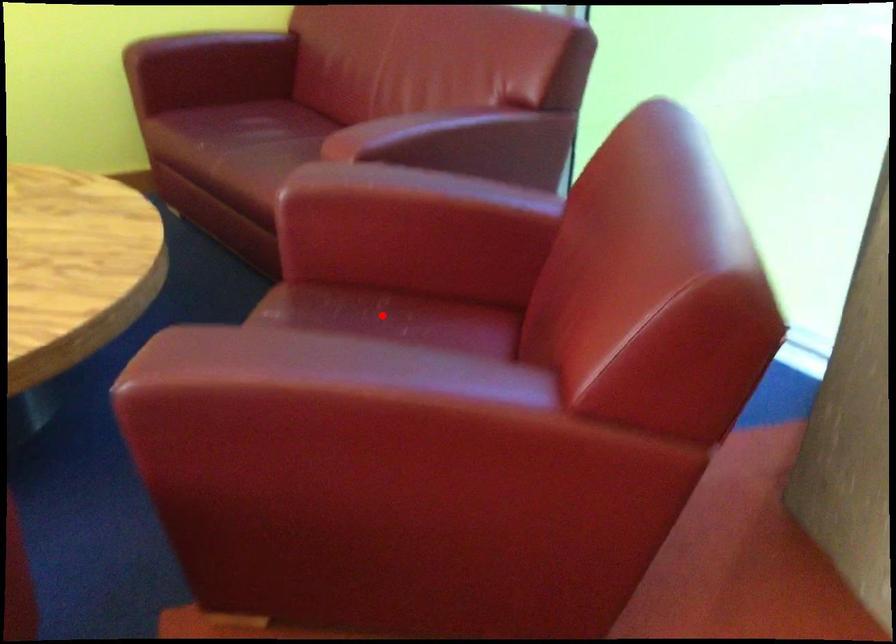
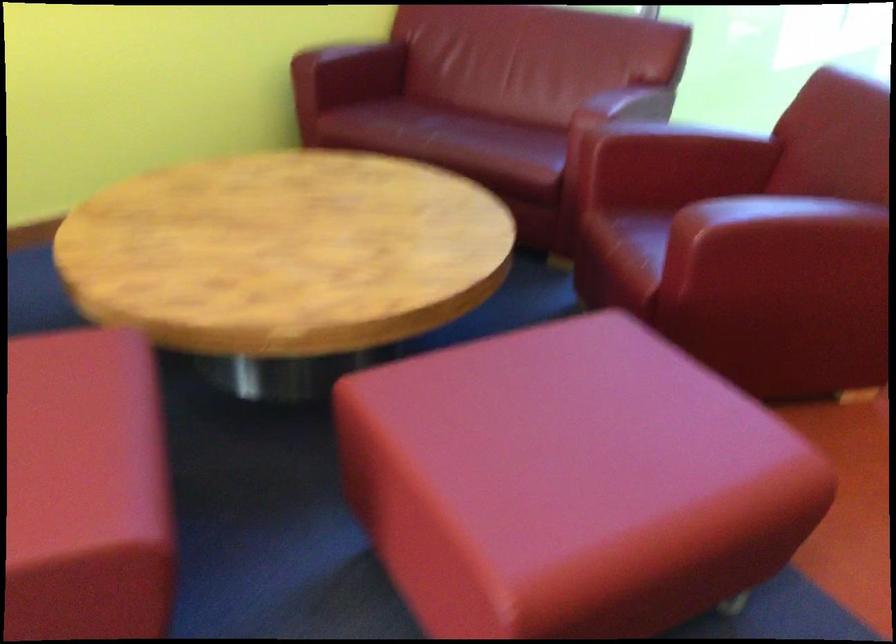
Question: I am providing you with two images of the same scene from different viewpoints. A red point is marked on the first image. Can you still see the location of the red point in image 2?

Choices:
 (A) Yes
 (B) No

Answer: (B)